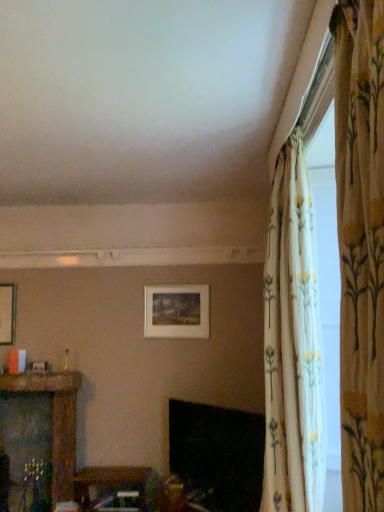
Question: Considering their positions, is matte white picture frame at center located in front of or behind floral fabric curtain at upper right, the 2th curtain viewed from the front?

Choices:
 (A) behind
 (B) front

Answer: (A)

Question: Looking at their shapes, would you say matte white picture frame at center is wider or thinner than floral fabric curtain at upper right, the 1th curtain positioned from the back?

Choices:
 (A) wide
 (B) thin

Answer: (B)

Question: Which of these objects is positioned closest to the matte white picture frame at center?

Choices:
 (A) black glossy fireplace at lower center
 (B) floral fabric curtain at upper right, the 2th curtain viewed from the front
 (C) wooden table at lower center, positioned as the first furniture in right-to-left order
 (D) wooden carved shelf at left, the 1th furniture from the left
 (E) floral fabric curtain at right, marked as the first curtain in a front-to-back arrangement

Answer: (A)

Question: Which is nearer to the wooden table at lower center, the 2th furniture positioned from the left?

Choices:
 (A) floral fabric curtain at right, marked as the first curtain in a front-to-back arrangement
 (B) matte white picture frame at center
 (C) black glossy fireplace at lower center
 (D) wooden carved shelf at left, arranged as the 2th furniture when viewed from the right
 (E) floral fabric curtain at upper right, the 1th curtain positioned from the back

Answer: (D)